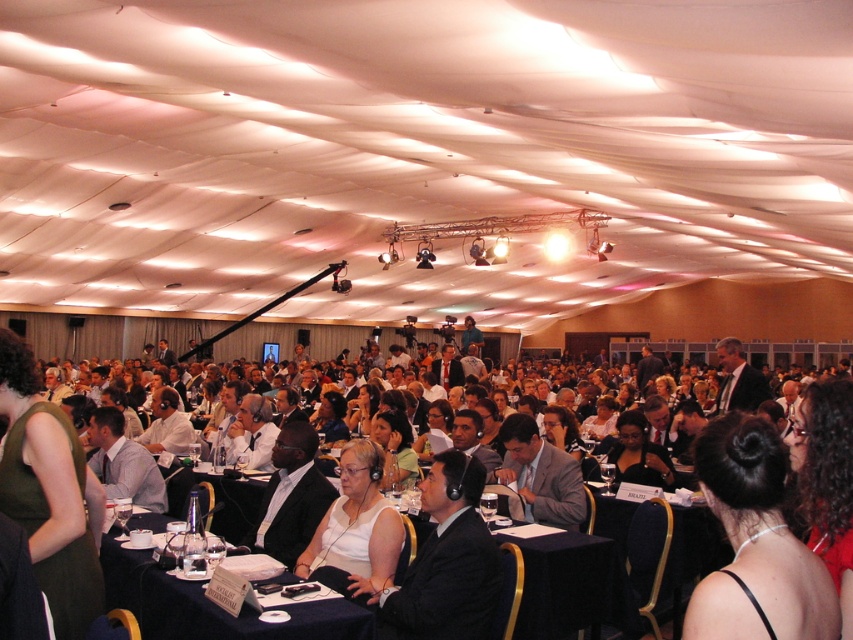
Question: Can you confirm if white shirt at center is positioned to the left of dark blue fabric table at center?

Choices:
 (A) yes
 (B) no

Answer: (B)

Question: Which of these objects is positioned farthest from the green fabric dress at lower left?

Choices:
 (A) dark blue fabric table at center
 (B) black satin dress at lower right
 (C) white shirt at center

Answer: (B)

Question: Does black suit at center appear on the right side of light gray suit at center?

Choices:
 (A) yes
 (B) no

Answer: (B)

Question: Which point is farther to the camera?

Choices:
 (A) (381, 632)
 (B) (56, 433)
 (C) (294, 611)
 (D) (482, 547)

Answer: (A)

Question: Which point is closer to the camera?

Choices:
 (A) white matte shirt at center
 (B) dark blue fabric table at center
 (C) light gray suit at center
 (D) black suit at center

Answer: (B)

Question: Is dark blue fabric table at center to the left of light gray suit at center from the viewer's perspective?

Choices:
 (A) no
 (B) yes

Answer: (B)